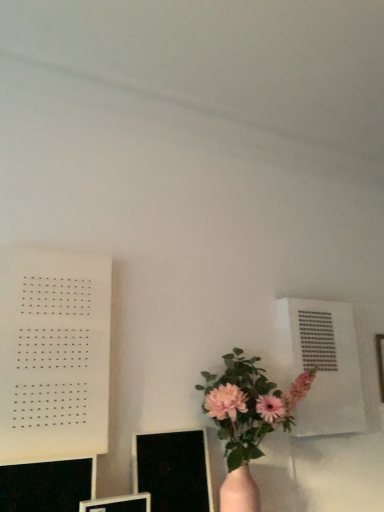
Locate an element on the screen. This screenshot has width=384, height=512. black glossy computer monitor at lower center, acting as the first computer monitor starting from the right is located at coordinates click(173, 470).

I want to click on matte black monitor at lower left, the 2th computer monitor from the left, so click(x=118, y=504).

From the image's perspective, is white paper at left under black glossy computer monitor at lower left, the first computer monitor viewed from the left?

No.

Is white paper at left situated inside black glossy computer monitor at lower left, the first computer monitor viewed from the left, or outside?

white paper at left is not inside black glossy computer monitor at lower left, the first computer monitor viewed from the left, it's outside.

Find the location of `the 2nd computer monitor positioned below the white paper at left (from a real-world perspective)`. the 2nd computer monitor positioned below the white paper at left (from a real-world perspective) is located at coordinates (47, 485).

Considering the sizes of objects pink matte vase at lower center and matte black monitor at lower left, the 2th computer monitor from the left, in the image provided, who is wider, pink matte vase at lower center or matte black monitor at lower left, the 2th computer monitor from the left,?

Wider between the two is pink matte vase at lower center.

You are a GUI agent. You are given a task and a screenshot of the screen. Output one action in this format:
    pyautogui.click(x=<x>, y=<y>)
    Task: Click on the houseplant lying on the right of matte black monitor at lower left, marked as the second computer monitor in a right-to-left arrangement
    The height and width of the screenshot is (512, 384).
    Given the screenshot: What is the action you would take?
    pyautogui.click(x=247, y=421)

Is pink matte vase at lower center oriented away from matte black monitor at lower left, the 2th computer monitor from the left?

No.

Does pink matte vase at lower center appear on the right side of matte black monitor at lower left, the 2th computer monitor from the left?

Correct, you'll find pink matte vase at lower center to the right of matte black monitor at lower left, the 2th computer monitor from the left.

Measure the distance between matte black monitor at lower left, the 2th computer monitor from the left, and black glossy computer monitor at lower left, the first computer monitor viewed from the left.

matte black monitor at lower left, the 2th computer monitor from the left, and black glossy computer monitor at lower left, the first computer monitor viewed from the left, are 14.30 centimeters apart.

Is black glossy computer monitor at lower left, the first computer monitor viewed from the left, at the back of matte black monitor at lower left, the 2th computer monitor from the left?

No, matte black monitor at lower left, the 2th computer monitor from the left,'s orientation is not away from black glossy computer monitor at lower left, the first computer monitor viewed from the left.

Is matte black monitor at lower left, the 2th computer monitor from the left, in front of black glossy computer monitor at lower left, which is the third computer monitor in right-to-left order?

No, matte black monitor at lower left, the 2th computer monitor from the left, is further to the viewer.

From a real-world perspective, which is physically above, matte black monitor at lower left, marked as the second computer monitor in a right-to-left arrangement, or pink matte vase at lower center?

From a 3D spatial view, pink matte vase at lower center is above.

Does matte black monitor at lower left, the 2th computer monitor from the left, touch pink matte vase at lower center?

There is a gap between matte black monitor at lower left, the 2th computer monitor from the left, and pink matte vase at lower center.

From the image's perspective, would you say matte black monitor at lower left, marked as the second computer monitor in a right-to-left arrangement, is shown under pink matte vase at lower center?

Yes, from the image's perspective, matte black monitor at lower left, marked as the second computer monitor in a right-to-left arrangement, is beneath pink matte vase at lower center.

Is black glossy computer monitor at lower left, which is the third computer monitor in right-to-left order, far away from black glossy computer monitor at lower center, acting as the first computer monitor starting from the right?

black glossy computer monitor at lower left, which is the third computer monitor in right-to-left order, is near black glossy computer monitor at lower center, acting as the first computer monitor starting from the right, not far away.

How many degrees apart are the facing directions of black glossy computer monitor at lower left, the first computer monitor viewed from the left, and black glossy computer monitor at lower center, acting as the first computer monitor starting from the right?

The facing directions of black glossy computer monitor at lower left, the first computer monitor viewed from the left, and black glossy computer monitor at lower center, acting as the first computer monitor starting from the right, are 0.002 degrees apart.

Is black glossy computer monitor at lower left, the first computer monitor viewed from the left, bigger or smaller than black glossy computer monitor at lower center, acting as the first computer monitor starting from the right?

Clearly, black glossy computer monitor at lower left, the first computer monitor viewed from the left, is smaller in size than black glossy computer monitor at lower center, acting as the first computer monitor starting from the right.

Visually, is black glossy computer monitor at lower left, the first computer monitor viewed from the left, positioned to the left or to the right of black glossy computer monitor at lower center, which appears as the 3th computer monitor when viewed from the left?

From the image, it's evident that black glossy computer monitor at lower left, the first computer monitor viewed from the left, is to the left of black glossy computer monitor at lower center, which appears as the 3th computer monitor when viewed from the left.

Between pink matte vase at lower center and black glossy computer monitor at lower left, which is the third computer monitor in right-to-left order, which one has smaller size?

With smaller size is black glossy computer monitor at lower left, which is the third computer monitor in right-to-left order.

Would you say pink matte vase at lower center is outside black glossy computer monitor at lower left, which is the third computer monitor in right-to-left order?

pink matte vase at lower center lies outside black glossy computer monitor at lower left, which is the third computer monitor in right-to-left order,'s area.

Considering their positions, is pink matte vase at lower center located in front of or behind black glossy computer monitor at lower left, the first computer monitor viewed from the left?

pink matte vase at lower center is behind black glossy computer monitor at lower left, the first computer monitor viewed from the left.

Which is behind, point (252, 483) or point (81, 492)?

The point (252, 483) is behind.

Is white paper at left facing towards black glossy computer monitor at lower center, acting as the first computer monitor starting from the right?

No, white paper at left is not turned towards black glossy computer monitor at lower center, acting as the first computer monitor starting from the right.

Is white paper at left positioned beyond the bounds of black glossy computer monitor at lower center, acting as the first computer monitor starting from the right?

Yes, white paper at left is outside of black glossy computer monitor at lower center, acting as the first computer monitor starting from the right.

In the scene shown: Does white paper at left have a lesser width compared to black glossy computer monitor at lower center, acting as the first computer monitor starting from the right?

No.

From a real-world perspective, is white paper at left on black glossy computer monitor at lower center, acting as the first computer monitor starting from the right?

Yes, from a real-world perspective, white paper at left is above black glossy computer monitor at lower center, acting as the first computer monitor starting from the right.

Which computer monitor is the 2nd one when counting from the front of the white paper at left? Please provide its 2D coordinates.

[(47, 485)]

Where is `houseplant behind the matte black monitor at lower left, the 2th computer monitor from the left`? This screenshot has width=384, height=512. houseplant behind the matte black monitor at lower left, the 2th computer monitor from the left is located at coordinates (247, 421).

Which object lies nearer to the anchor point black glossy computer monitor at lower center, acting as the first computer monitor starting from the right, white paper at left or pink matte vase at lower center?

The object closer to black glossy computer monitor at lower center, acting as the first computer monitor starting from the right, is pink matte vase at lower center.

Which object lies further to the anchor point black glossy computer monitor at lower left, the first computer monitor viewed from the left, black glossy computer monitor at lower center, which appears as the 3th computer monitor when viewed from the left, or pink matte vase at lower center?

Based on the image, pink matte vase at lower center appears to be further to black glossy computer monitor at lower left, the first computer monitor viewed from the left.

Considering their positions, is black glossy computer monitor at lower center, acting as the first computer monitor starting from the right, positioned closer to white paper at left than black glossy computer monitor at lower left, which is the third computer monitor in right-to-left order?

black glossy computer monitor at lower left, which is the third computer monitor in right-to-left order, is positioned closer to the anchor white paper at left.

Estimate the real-world distances between objects in this image. Which object is closer to matte black monitor at lower left, the 2th computer monitor from the left, white paper at left or black glossy computer monitor at lower center, acting as the first computer monitor starting from the right?

Among the two, black glossy computer monitor at lower center, acting as the first computer monitor starting from the right, is located nearer to matte black monitor at lower left, the 2th computer monitor from the left.

When comparing their distances from pink matte vase at lower center, does matte black monitor at lower left, marked as the second computer monitor in a right-to-left arrangement, or black glossy computer monitor at lower left, which is the third computer monitor in right-to-left order, seem closer?

matte black monitor at lower left, marked as the second computer monitor in a right-to-left arrangement, lies closer to pink matte vase at lower center than the other object.

Which object lies further to the anchor point white paper at left, pink matte vase at lower center or matte black monitor at lower left, marked as the second computer monitor in a right-to-left arrangement?

pink matte vase at lower center is further to white paper at left.

From the image, which object appears to be farther from black glossy computer monitor at lower left, which is the third computer monitor in right-to-left order, matte black monitor at lower left, marked as the second computer monitor in a right-to-left arrangement, or pink matte vase at lower center?

The object further to black glossy computer monitor at lower left, which is the third computer monitor in right-to-left order, is pink matte vase at lower center.

Which object lies nearer to the anchor point pink matte vase at lower center, black glossy computer monitor at lower center, which appears as the 3th computer monitor when viewed from the left, or matte black monitor at lower left, marked as the second computer monitor in a right-to-left arrangement?

black glossy computer monitor at lower center, which appears as the 3th computer monitor when viewed from the left, is positioned closer to the anchor pink matte vase at lower center.

Locate an element on the screen. The image size is (384, 512). computer monitor between matte black monitor at lower left, marked as the second computer monitor in a right-to-left arrangement, and pink matte vase at lower center, in the horizontal direction is located at coordinates click(x=173, y=470).

Locate an element on the screen. computer monitor that lies between white paper at left and black glossy computer monitor at lower center, which appears as the 3th computer monitor when viewed from the left, from top to bottom is located at coordinates (47, 485).

Image resolution: width=384 pixels, height=512 pixels. What are the coordinates of `computer monitor located between black glossy computer monitor at lower left, the first computer monitor viewed from the left, and black glossy computer monitor at lower center, which appears as the 3th computer monitor when viewed from the left, in the left-right direction` in the screenshot? It's located at (118, 504).